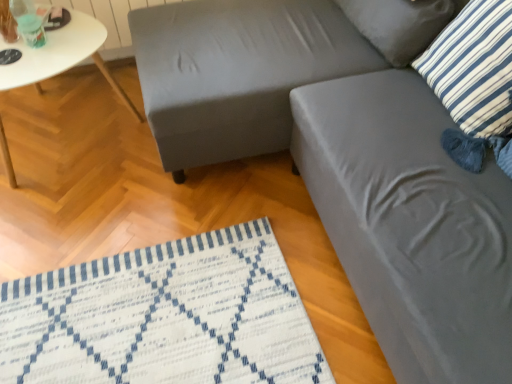
Question: Is white glossy table at left positioned with its back to matte gray swivel chair at center, arranged as the 1th swivel chair when ordered from the bottom?

Choices:
 (A) yes
 (B) no

Answer: (B)

Question: Is white glossy table at left in contact with matte gray swivel chair at center, arranged as the 1th swivel chair when ordered from the bottom?

Choices:
 (A) no
 (B) yes

Answer: (A)

Question: From a real-world perspective, is white glossy table at left on top of matte gray swivel chair at center, acting as the second swivel chair starting from the top?

Choices:
 (A) yes
 (B) no

Answer: (B)

Question: Is white glossy table at left aimed at matte gray swivel chair at center, arranged as the 1th swivel chair when ordered from the bottom?

Choices:
 (A) yes
 (B) no

Answer: (B)

Question: Is white glossy table at left to the right of matte gray swivel chair at center, acting as the second swivel chair starting from the top, from the viewer's perspective?

Choices:
 (A) no
 (B) yes

Answer: (A)

Question: Does white glossy table at left have a smaller size compared to matte gray swivel chair at center, arranged as the 1th swivel chair when ordered from the bottom?

Choices:
 (A) yes
 (B) no

Answer: (A)

Question: Is blue striped pillow at upper right, the 1th pillow viewed from the back, facing away from blue and white striped pillow at upper right, positioned as the second pillow in back-to-front order?

Choices:
 (A) no
 (B) yes

Answer: (A)

Question: Is blue striped pillow at upper right, which is counted as the second pillow, starting from the front, positioned behind blue and white striped pillow at upper right, acting as the first pillow starting from the front?

Choices:
 (A) no
 (B) yes

Answer: (B)

Question: Considering the relative sizes of blue striped pillow at upper right, which is counted as the second pillow, starting from the front, and blue and white striped pillow at upper right, acting as the first pillow starting from the front, in the image provided, is blue striped pillow at upper right, which is counted as the second pillow, starting from the front, bigger than blue and white striped pillow at upper right, acting as the first pillow starting from the front,?

Choices:
 (A) no
 (B) yes

Answer: (A)

Question: Would you say blue striped pillow at upper right, which is counted as the second pillow, starting from the front, is a long distance from blue and white striped pillow at upper right, positioned as the second pillow in back-to-front order?

Choices:
 (A) yes
 (B) no

Answer: (B)

Question: Is blue and white striped pillow at upper right, positioned as the second pillow in back-to-front order, located within blue striped pillow at upper right, which is counted as the second pillow, starting from the front?

Choices:
 (A) yes
 (B) no

Answer: (B)

Question: From the image's perspective, does blue striped pillow at upper right, the 1th pillow viewed from the back, appear higher than blue and white striped pillow at upper right, positioned as the second pillow in back-to-front order?

Choices:
 (A) no
 (B) yes

Answer: (B)

Question: Can you confirm if blue and white striped pillow at upper right, positioned as the second pillow in back-to-front order, is shorter than matte gray swivel chair at center, acting as the second swivel chair starting from the top?

Choices:
 (A) yes
 (B) no

Answer: (A)